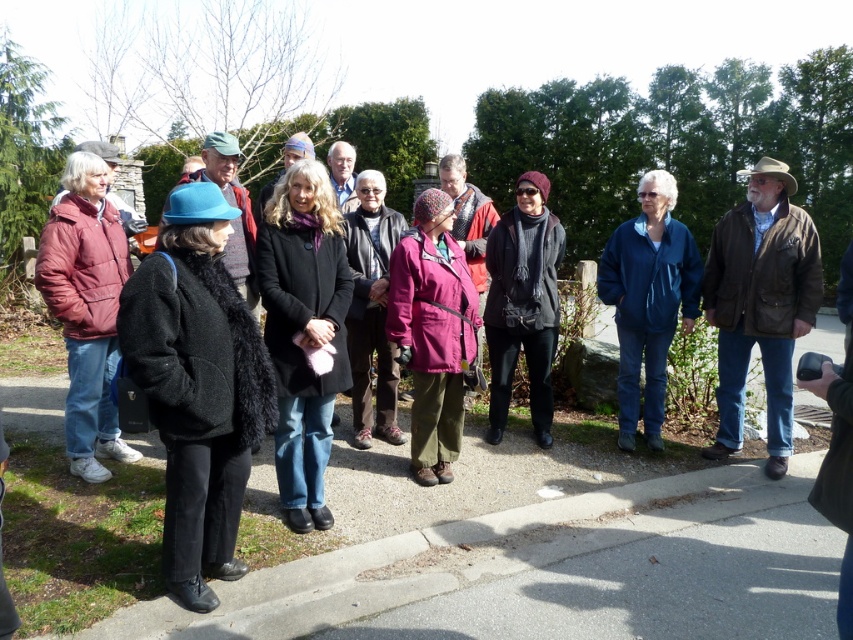
Question: Where is brown leather jacket at right located in relation to matte red puffer jacket at left in the image?

Choices:
 (A) left
 (B) right

Answer: (B)

Question: Can you confirm if matte pink jacket at center is bigger than pink fabric jacket at center?

Choices:
 (A) no
 (B) yes

Answer: (A)

Question: Among these objects, which one is farthest from the camera?

Choices:
 (A) black wool coat at center
 (B) knitted dark gray scarf at center
 (C) matte black coat at left
 (D) matte red puffer jacket at left

Answer: (B)

Question: Among these objects, which one is nearest to the camera?

Choices:
 (A) blue fleece jacket at center
 (B) matte black coat at left
 (C) black wool coat at center
 (D) knitted dark gray scarf at center

Answer: (B)

Question: Among these objects, which one is nearest to the camera?

Choices:
 (A) black wool coat at center
 (B) brown leather jacket at right
 (C) pink fabric jacket at center
 (D) blue fleece jacket at center

Answer: (A)

Question: From the image, what is the correct spatial relationship of matte black coat at left in relation to pink fabric jacket at center?

Choices:
 (A) above
 (B) below

Answer: (B)